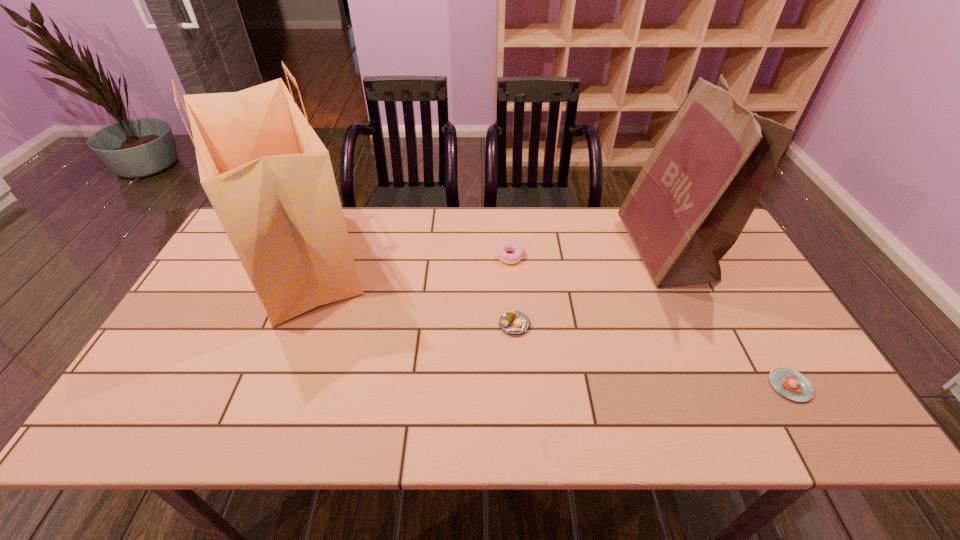
Where is `free space that satisfies the following two spatial constraints: 1. on the side of the left grocery bag with the superhero design; 2. on the left side of the nearest pastry`? free space that satisfies the following two spatial constraints: 1. on the side of the left grocery bag with the superhero design; 2. on the left side of the nearest pastry is located at coordinates (244, 386).

The height and width of the screenshot is (540, 960). I want to click on free spot that satisfies the following two spatial constraints: 1. on the back side of the second nearest pastry; 2. on the right side of the farthest pastry, so click(x=510, y=256).

Image resolution: width=960 pixels, height=540 pixels. I want to click on blank space that satisfies the following two spatial constraints: 1. on the side of the left grocery bag with the superhero design; 2. on the right side of the second nearest pastry, so click(x=270, y=325).